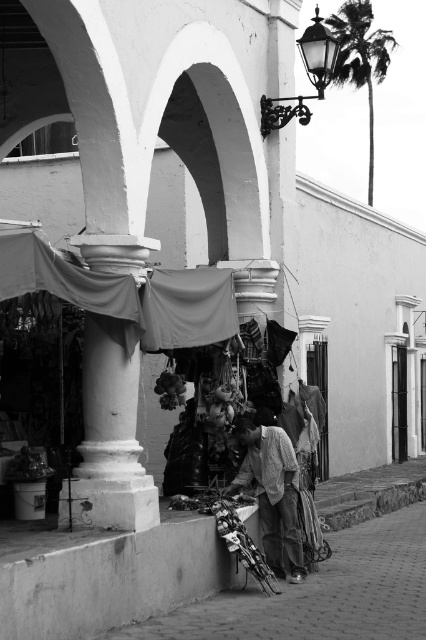
Can you confirm if smooth concrete pavement at lower center is thinner than light gray fabric at center?

No.

Is point (412, 522) in front of point (267, 444)?

That is False.

At what (x,y) coordinates should I click in order to perform the action: click on smooth concrete pavement at lower center. Please return your answer as a coordinate pair (x, y). Looking at the image, I should click on click(322, 595).